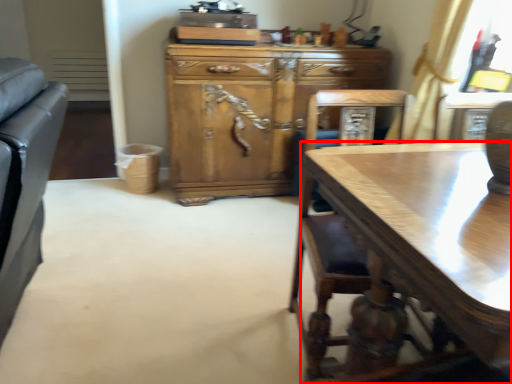
Question: From the image's perspective, where is desk (annotated by the red box) located relative to cabinetry?

Choices:
 (A) above
 (B) below

Answer: (B)